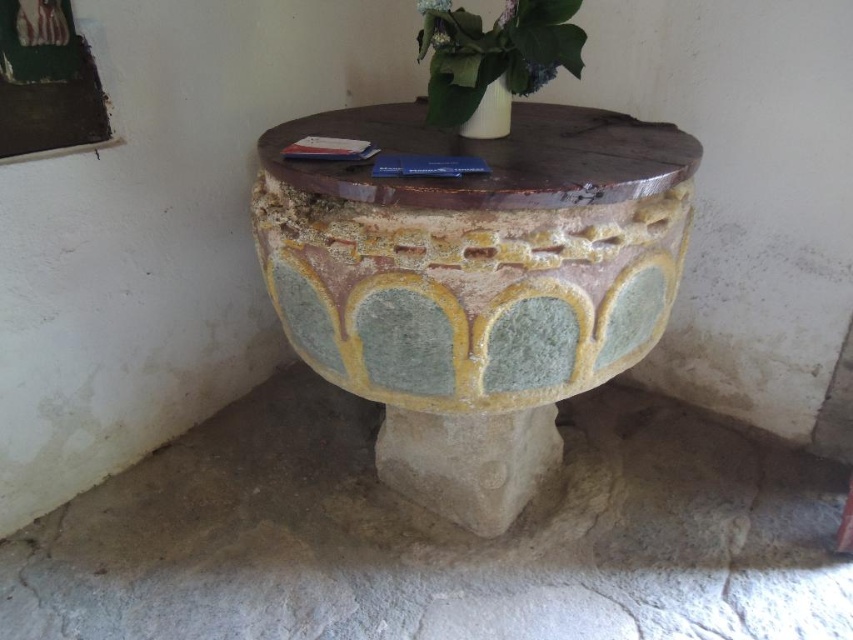
Question: Is speckled stone table at center wider than white glossy vase at upper center?

Choices:
 (A) no
 (B) yes

Answer: (B)

Question: Which is nearer to the green matte vase at upper center?

Choices:
 (A) white glossy vase at upper center
 (B) speckled stone table at center

Answer: (A)

Question: Considering the relative positions of speckled stone table at center and white glossy vase at upper center in the image provided, where is speckled stone table at center located with respect to white glossy vase at upper center?

Choices:
 (A) left
 (B) right

Answer: (A)

Question: Where is speckled stone table at center located in relation to green matte vase at upper center in the image?

Choices:
 (A) left
 (B) right

Answer: (A)

Question: Which point is farther from the camera taking this photo?

Choices:
 (A) (506, 99)
 (B) (558, 52)

Answer: (A)

Question: Among these points, which one is nearest to the camera?

Choices:
 (A) (468, 134)
 (B) (508, 97)
 (C) (515, 115)

Answer: (B)